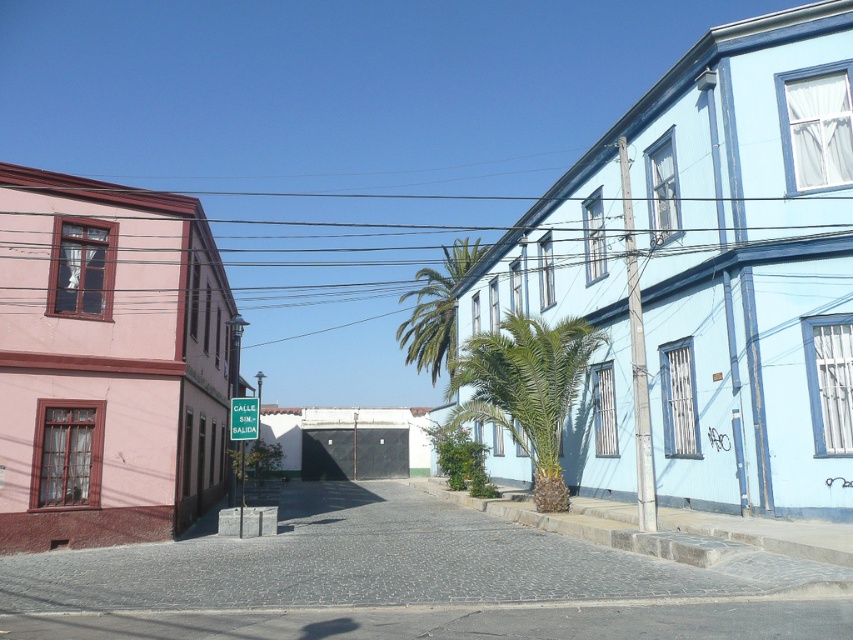
Between green leafy palm at center and green plastic sign at center, which one appears on the right side from the viewer's perspective?

From the viewer's perspective, green leafy palm at center appears more on the right side.

Is green leafy palm at center closer to camera compared to green plastic sign at center?

No, green leafy palm at center is behind green plastic sign at center.

Is point (555, 435) positioned after point (239, 406)?

That is True.

Locate an element on the screen. green leafy palm at center is located at coordinates (527, 388).

Can you confirm if green leafy palm at center is wider than green leafy palm tree at center?

Incorrect, green leafy palm at center's width does not surpass green leafy palm tree at center's.

Can you confirm if green leafy palm at center is thinner than green leafy palm tree at center?

Correct, green leafy palm at center's width is less than green leafy palm tree at center's.

What do you see at coordinates (527, 388) in the screenshot? I see `green leafy palm at center` at bounding box center [527, 388].

Where is `green leafy palm at center`? green leafy palm at center is located at coordinates (527, 388).

Can you confirm if green leafy palm tree at center is taller than green plastic sign at center?

Yes, green leafy palm tree at center is taller than green plastic sign at center.

Who is shorter, green leafy palm tree at center or green plastic sign at center?

green plastic sign at center is shorter.

Is point (451, 250) closer to viewer compared to point (233, 420)?

No, it is behind (233, 420).

Identify the location of green leafy palm tree at center. (436, 312).